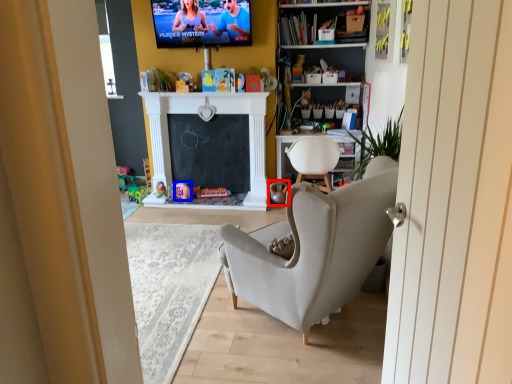
Question: Which point is closer to the camera, toy (highlighted by a red box) or toy (highlighted by a blue box)?

Choices:
 (A) toy
 (B) toy

Answer: (A)